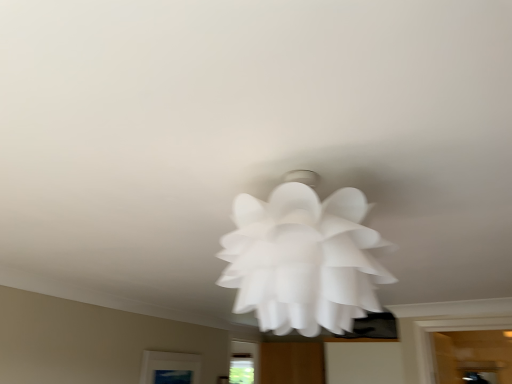
Question: Considering the positions of matte glass window at lower center and white paper flower at center in the image, is matte glass window at lower center bigger or smaller than white paper flower at center?

Choices:
 (A) small
 (B) big

Answer: (A)

Question: In terms of height, does matte glass window at lower center look taller or shorter compared to white paper flower at center?

Choices:
 (A) short
 (B) tall

Answer: (A)

Question: Is point (190, 360) closer or farther from the camera than point (276, 215)?

Choices:
 (A) farther
 (B) closer

Answer: (A)

Question: Relative to matte glass window at lower center, is white paper flower at center in front or behind?

Choices:
 (A) front
 (B) behind

Answer: (A)

Question: Considering the positions of point (349, 244) and point (178, 352), is point (349, 244) closer or farther from the camera than point (178, 352)?

Choices:
 (A) closer
 (B) farther

Answer: (A)

Question: From the image's perspective, is white paper flower at center positioned above or below matte glass window at lower center?

Choices:
 (A) above
 (B) below

Answer: (A)

Question: In terms of size, does white paper flower at center appear bigger or smaller than matte glass window at lower center?

Choices:
 (A) small
 (B) big

Answer: (B)